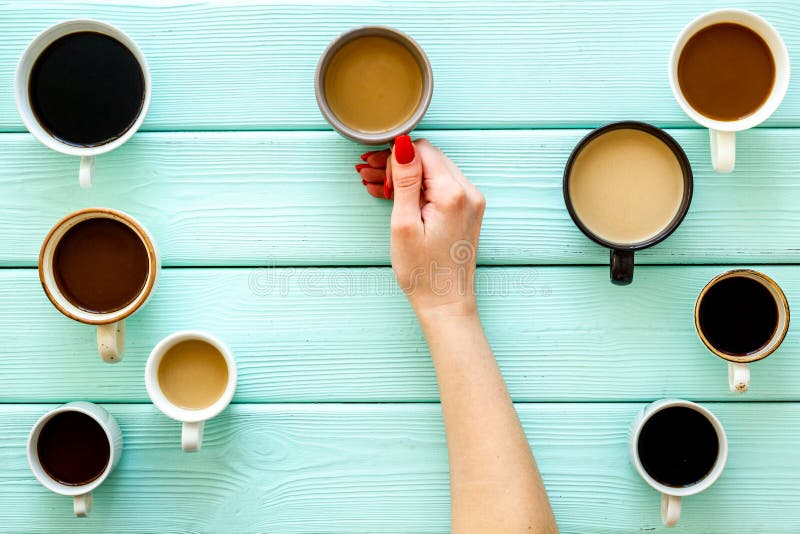
The width and height of the screenshot is (800, 534). I want to click on coffee cups, so click(84, 410), click(154, 373), click(154, 253), click(150, 74), click(424, 56), click(770, 105), click(690, 172), click(768, 281), click(722, 436).